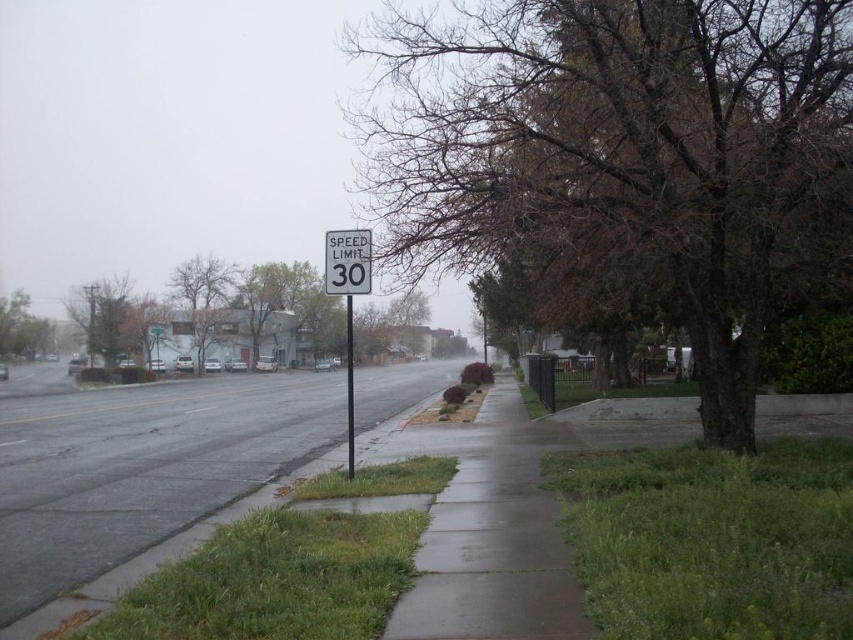
Is brown leafless tree at left to the right of metallic pole at center from the viewer's perspective?

Incorrect, brown leafless tree at left is not on the right side of metallic pole at center.

Does brown leafless tree at left lie behind metallic pole at center?

Yes, it is.

From the picture: Who is more distant from viewer, (x=193, y=300) or (x=350, y=312)?

Point (x=193, y=300)

The height and width of the screenshot is (640, 853). I want to click on brown leafless tree at left, so click(x=200, y=298).

Is green grass at lower right further to the viewer compared to metallic pole at center?

No.

Between point (711, 520) and point (350, 321), which one is positioned in front?

Point (711, 520) is in front.

At what (x,y) coordinates should I click in order to perform the action: click on green grass at lower right. Please return your answer as a coordinate pair (x, y). This screenshot has height=640, width=853. Looking at the image, I should click on (712, 540).

This screenshot has height=640, width=853. Describe the element at coordinates (712, 540) in the screenshot. I see `green grass at lower right` at that location.

Does point (677, 636) lie in front of point (32, 355)?

Yes, it is in front of point (32, 355).

Is point (718, 636) positioned in front of point (9, 316)?

Yes, point (718, 636) is in front of point (9, 316).

Where is `green grass at lower right`? green grass at lower right is located at coordinates (712, 540).